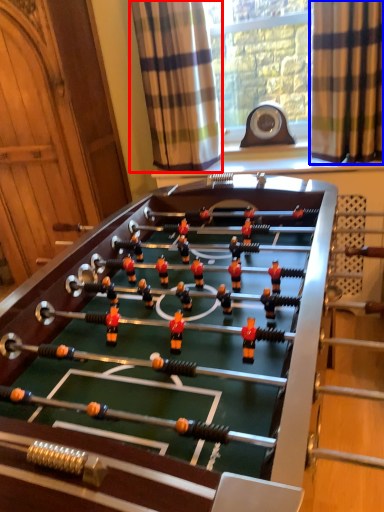
Question: Which object appears farthest to the camera in this image, curtain (highlighted by a red box) or curtain (highlighted by a blue box)?

Choices:
 (A) curtain
 (B) curtain

Answer: (A)